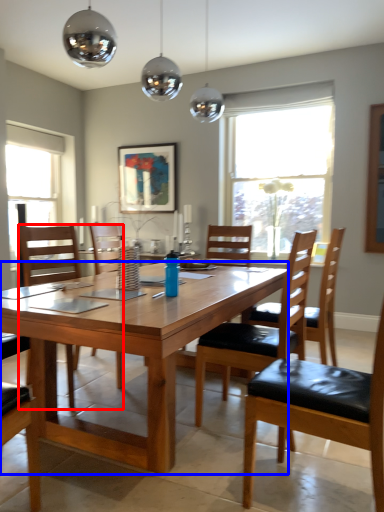
Question: Which point is further to the camera, chair (highlighted by a red box) or desk (highlighted by a blue box)?

Choices:
 (A) chair
 (B) desk

Answer: (A)